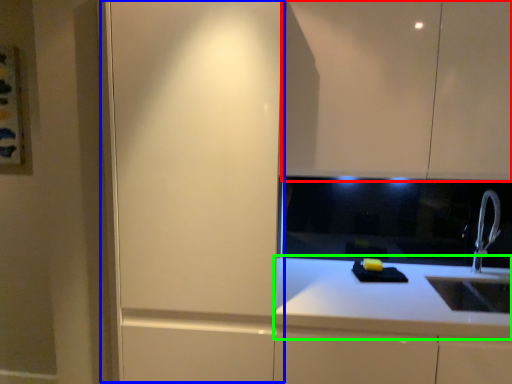
Question: Which object is positioned closest to cabinetry (highlighted by a red box)? Select from screen door (highlighted by a blue box) and countertop (highlighted by a green box).

Choices:
 (A) screen door
 (B) countertop

Answer: (A)